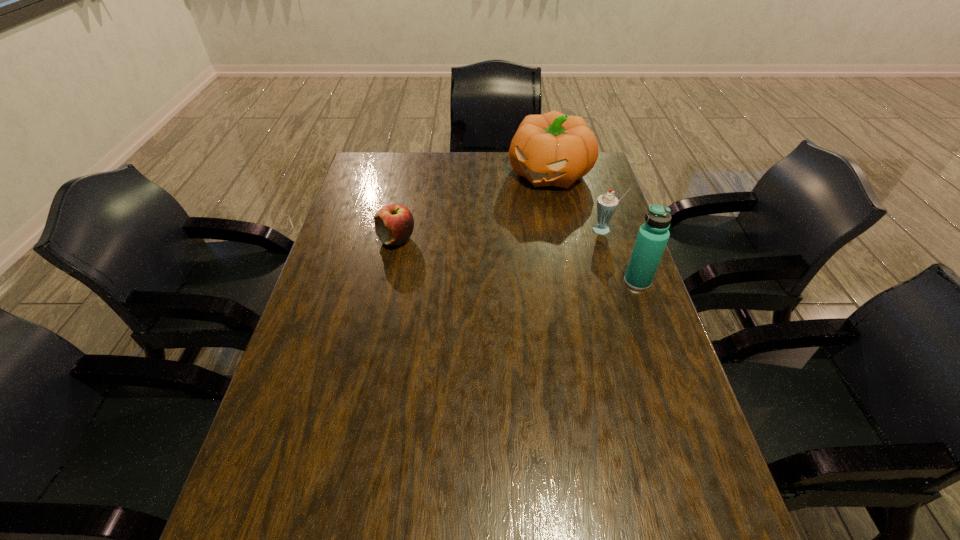
This screenshot has width=960, height=540. Identify the location of unoccupied position between the nearest object and the farthest object. (593, 227).

At what (x,y) coordinates should I click in order to perform the action: click on free area in between the farthest object and the thermos bottle. Please return your answer as a coordinate pair (x, y). Image resolution: width=960 pixels, height=540 pixels. Looking at the image, I should click on 593,227.

Identify the location of free space that is in between the shortest object and the farthest object. (472, 206).

You are a GUI agent. You are given a task and a screenshot of the screen. Output one action in this format:
    pyautogui.click(x=<x>, y=<y>)
    Task: Click on the free space between the apple and the milkshake
    
    Given the screenshot: What is the action you would take?
    [500, 235]

Image resolution: width=960 pixels, height=540 pixels. I want to click on object identified as the closest to the shortest object, so click(x=552, y=149).

Where is `object that is the nearest to the apple`? object that is the nearest to the apple is located at coordinates (552, 149).

Locate an element on the screen. This screenshot has height=540, width=960. free space that satisfies the following two spatial constraints: 1. on the front side of the farthest object; 2. on the left side of the thermos bottle is located at coordinates (571, 281).